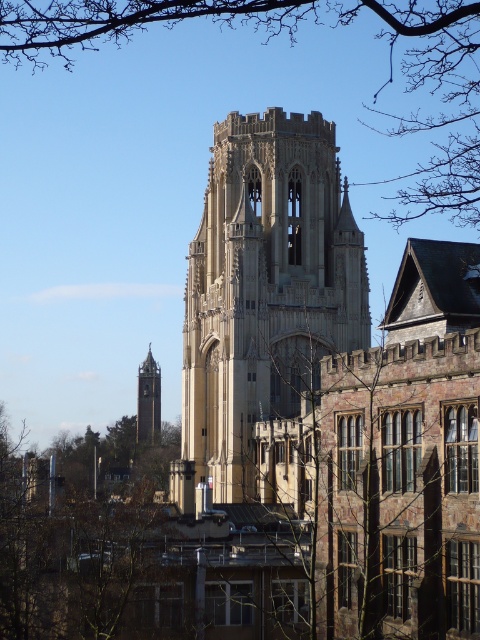
You are an architect analyzing the proportions of the beige stone tower at center and the brown leafless branches at upper center in the image. Which object appears shorter in the scene?

The beige stone tower at center appears shorter than the brown leafless branches at upper center in the scene.

You are an architect examining the cathedral and need to determine the spatial relationship between the beige stone tower at center and the smooth stone bell tower at center. Which one is positioned higher up in the image?

The beige stone tower at center is located above the smooth stone bell tower at center, so it is positioned higher up in the image.

You are standing in front of the historic church or cathedral. You notice two points marked on the tower. The first point is at coordinates point (277,349) and the second is at point (139,371). Which point is closer to you?

Point (277,349) is closer to the viewer than point (139,371).